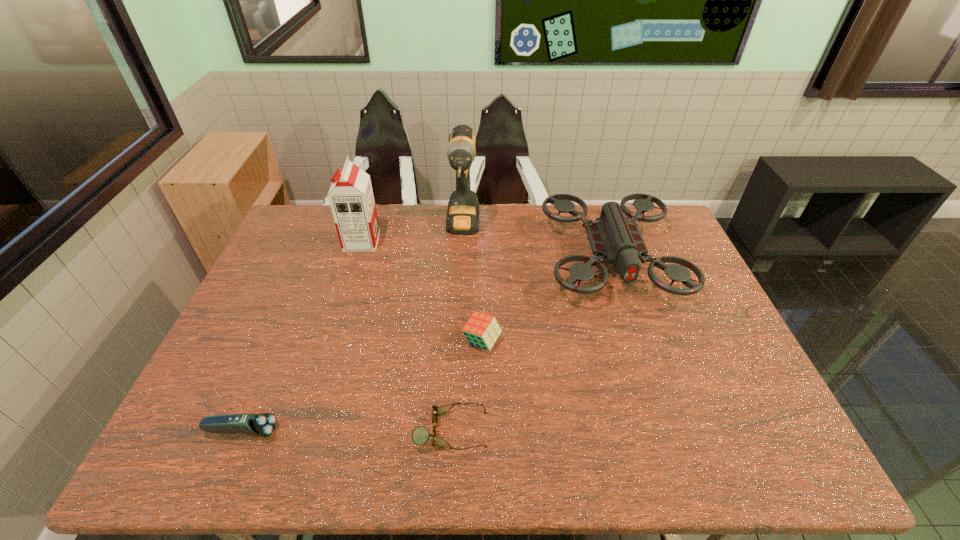
Locate an element on the screen. The width and height of the screenshot is (960, 540). object that is at the right edge is located at coordinates (611, 238).

Where is `object present at the near left corner`? The width and height of the screenshot is (960, 540). object present at the near left corner is located at coordinates (264, 424).

At what (x,y) coordinates should I click in order to perform the action: click on object at the far right corner. Please return your answer as a coordinate pair (x, y). The image size is (960, 540). Looking at the image, I should click on (611, 238).

At what (x,y) coordinates should I click in order to perform the action: click on vacant area at the far edge of the desktop. Please return your answer as a coordinate pair (x, y). This screenshot has height=540, width=960. Looking at the image, I should click on (491, 235).

Image resolution: width=960 pixels, height=540 pixels. I want to click on free space at the near edge of the desktop, so click(474, 469).

Where is `vacant space at the left edge of the desktop`? The width and height of the screenshot is (960, 540). vacant space at the left edge of the desktop is located at coordinates click(296, 318).

Find the location of `vacant region at the near left corner`. vacant region at the near left corner is located at coordinates [192, 462].

This screenshot has height=540, width=960. What are the coordinates of `vacant point located between the electric shaver and the third nearest object` in the screenshot? It's located at (362, 387).

Locate an element on the screen. unoccupied position between the soya milk and the drill is located at coordinates (413, 234).

I want to click on free space between the soya milk and the drone, so click(x=486, y=249).